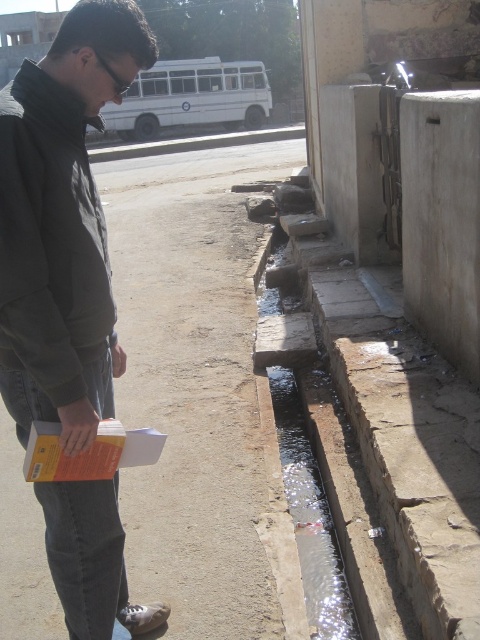
Does dark gray jacket at left lie in front of clear glass puddle at lower center?

Yes, dark gray jacket at left is closer to the viewer.

Based on the photo, between dark gray jacket at left and clear glass puddle at lower center, which one appears on the left side from the viewer's perspective?

dark gray jacket at left is more to the left.

Does point (99, 403) come closer to viewer compared to point (308, 563)?

Yes, it is.

You are a GUI agent. You are given a task and a screenshot of the screen. Output one action in this format:
    pyautogui.click(x=<x>, y=<y>)
    Task: Click on the dark gray jacket at left
    
    Given the screenshot: What is the action you would take?
    pyautogui.click(x=61, y=224)

Does point (92, 24) come behind point (140, 74)?

No, it is not.

Find the location of a particular element. The height and width of the screenshot is (640, 480). dark gray jacket at left is located at coordinates (61, 224).

Does clear glass puddle at lower center appear on the left side of white matte bus at upper center?

In fact, clear glass puddle at lower center is to the right of white matte bus at upper center.

Can you confirm if clear glass puddle at lower center is positioned above white matte bus at upper center?

Incorrect, clear glass puddle at lower center is not positioned above white matte bus at upper center.

The height and width of the screenshot is (640, 480). What are the coordinates of `clear glass puddle at lower center` in the screenshot? It's located at (311, 516).

The width and height of the screenshot is (480, 640). Identify the location of clear glass puddle at lower center. (311, 516).